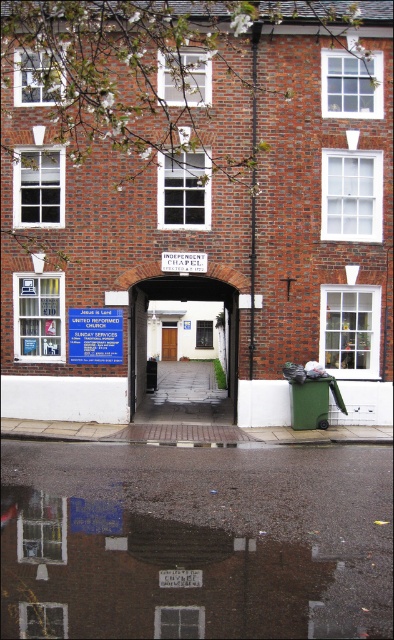
Question: Which point is closer to the camera?

Choices:
 (A) (133, 330)
 (B) (68, 339)

Answer: (B)

Question: Considering the relative positions of white wooden door at center and blue plastic sign at center in the image provided, where is white wooden door at center located with respect to blue plastic sign at center?

Choices:
 (A) right
 (B) left

Answer: (A)

Question: Which of the following is the farthest from the observer?

Choices:
 (A) (111, 346)
 (B) (141, 364)

Answer: (B)

Question: Is white wooden door at center behind blue plastic sign at center?

Choices:
 (A) yes
 (B) no

Answer: (A)

Question: Which object is farther from the camera taking this photo?

Choices:
 (A) white wooden door at center
 (B) blue plastic sign at center

Answer: (A)

Question: Does white wooden door at center have a smaller size compared to blue plastic sign at center?

Choices:
 (A) yes
 (B) no

Answer: (B)